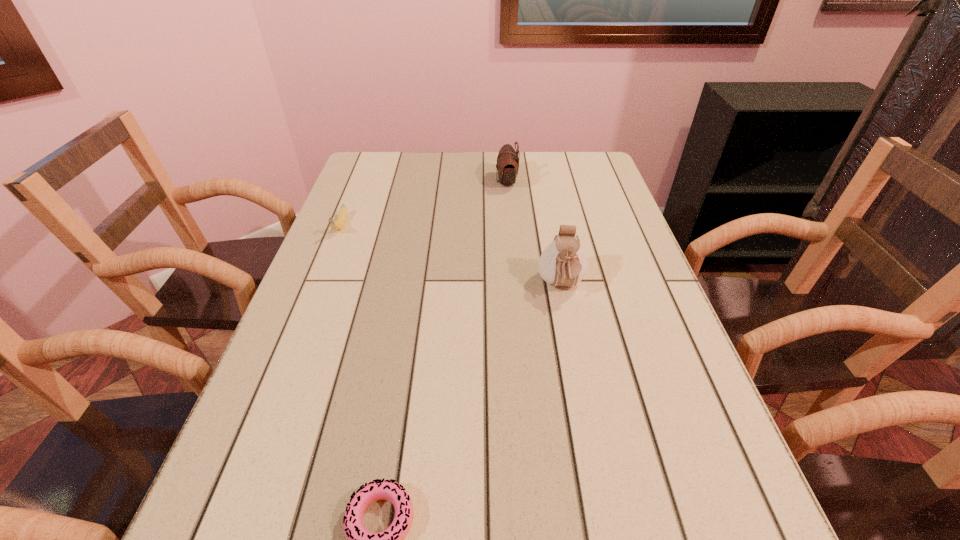
The height and width of the screenshot is (540, 960). I want to click on the third farthest object, so click(x=563, y=262).

Find the location of a particular element. Image resolution: width=960 pixels, height=540 pixels. the nearer pouch is located at coordinates (563, 262).

Where is `the left pouch`? the left pouch is located at coordinates (507, 165).

Where is `the third shortest object`? The width and height of the screenshot is (960, 540). the third shortest object is located at coordinates (507, 165).

This screenshot has width=960, height=540. Find the location of `the leftmost object`. the leftmost object is located at coordinates (340, 222).

Where is `the third tallest object`? This screenshot has width=960, height=540. the third tallest object is located at coordinates (340, 222).

The width and height of the screenshot is (960, 540). I want to click on vacant space located on the front-facing side of the third farthest object, so click(591, 440).

This screenshot has width=960, height=540. In order to click on vacant area located 0.310m with the flap open on the shorter pouch in this screenshot , I will do `click(395, 182)`.

Where is `blank area located with the flap open on the shorter pouch`? The height and width of the screenshot is (540, 960). blank area located with the flap open on the shorter pouch is located at coordinates (415, 182).

Where is `free space located 0.250m with the flap open on the shorter pouch`? free space located 0.250m with the flap open on the shorter pouch is located at coordinates (415, 182).